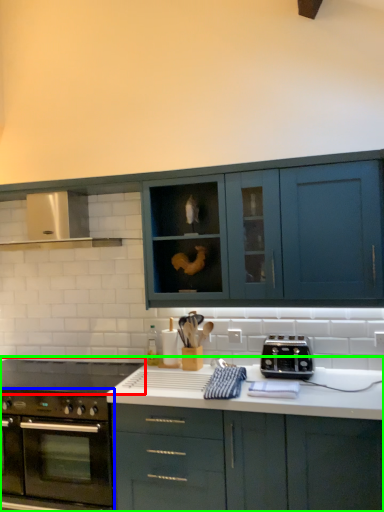
Question: Estimate the real-world distances between objects in this image. Which object is closer to gas stove (highlighted by a red box), oven (highlighted by a blue box) or cabinetry (highlighted by a green box)?

Choices:
 (A) oven
 (B) cabinetry

Answer: (A)